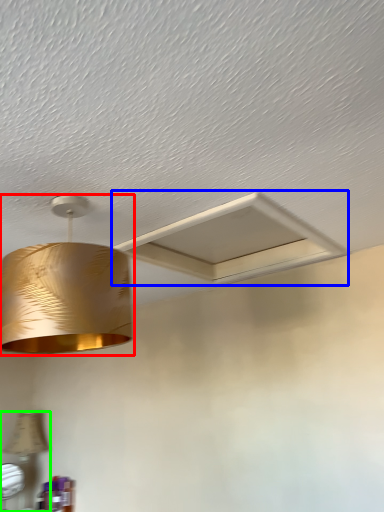
Question: Which object is the closest to the lamp (highlighted by a red box)? Choose among these: exhaust hood (highlighted by a blue box) or lamp (highlighted by a green box).

Choices:
 (A) exhaust hood
 (B) lamp

Answer: (A)